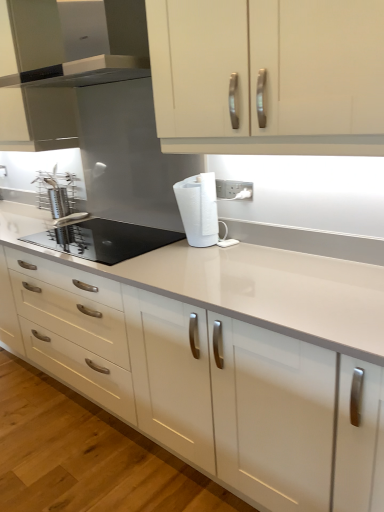
Question: In the image, is white glossy cabinet doors at upper center, the first cabinetry positioned from the right, on the left side or the right side of satin silver range hood at upper left?

Choices:
 (A) left
 (B) right

Answer: (B)

Question: Is white glossy cabinet doors at upper center, which appears as the 1th cabinetry when viewed from the front, taller or shorter than satin silver range hood at upper left?

Choices:
 (A) tall
 (B) short

Answer: (A)

Question: Which object is the farthest from the white glossy countertop at center?

Choices:
 (A) satin silver range hood at upper left
 (B) white matte paper towel at center
 (C) matte white cabinet at upper center, the second cabinetry in the front-to-back sequence
 (D) black glass cooktop at center-left
 (E) white glossy cabinet doors at upper center, which is the 2th cabinetry from left to right

Answer: (C)

Question: Which of these objects is positioned farthest from the white glossy countertop at center?

Choices:
 (A) satin silver range hood at upper left
 (B) black glass cooktop at center-left
 (C) white glossy cabinet doors at upper center, which is the 2th cabinetry from left to right
 (D) white matte paper towel at center
 (E) matte white cabinet at upper center, which appears as the first cabinetry when viewed from the left

Answer: (E)